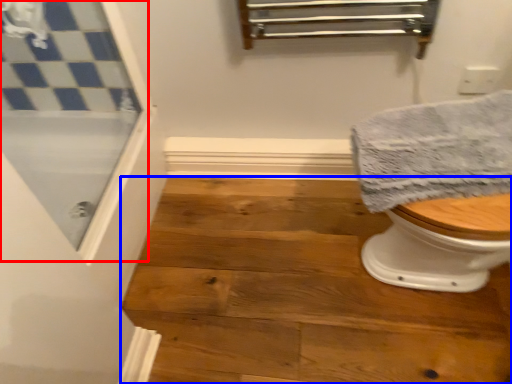
Question: Which object is further to the camera taking this photo, screen door (highlighted by a red box) or stair (highlighted by a blue box)?

Choices:
 (A) screen door
 (B) stair

Answer: (B)